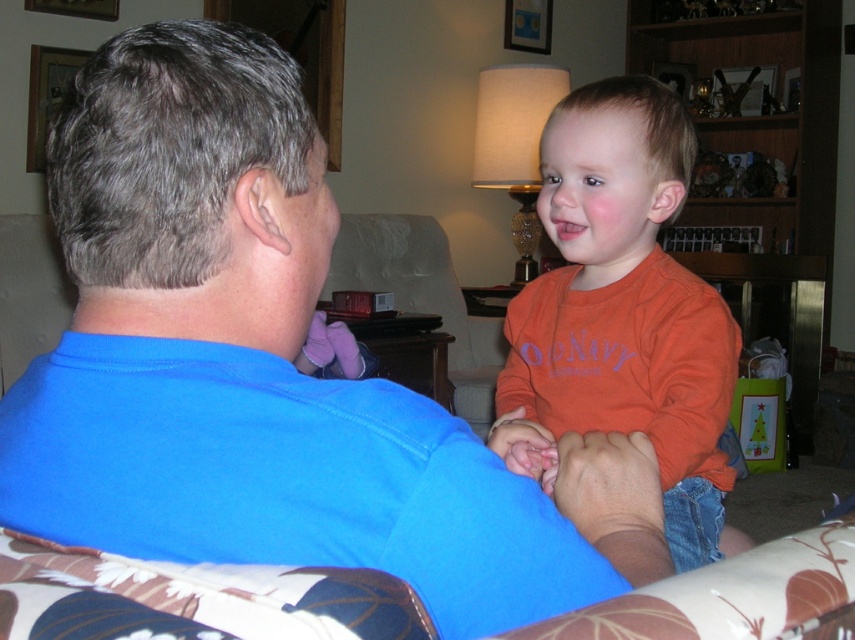
You are a photographer trying to capture a candid shot of both the blue cotton shirt at center and the orange cotton shirt at center. Since you want to ensure both are visible in the frame, which shirt should you focus on first to avoid blurring the background?

The blue cotton shirt at center is below orange cotton shirt at center, so you should focus on the orange cotton shirt at center first to keep both in focus as they are stacked vertically.